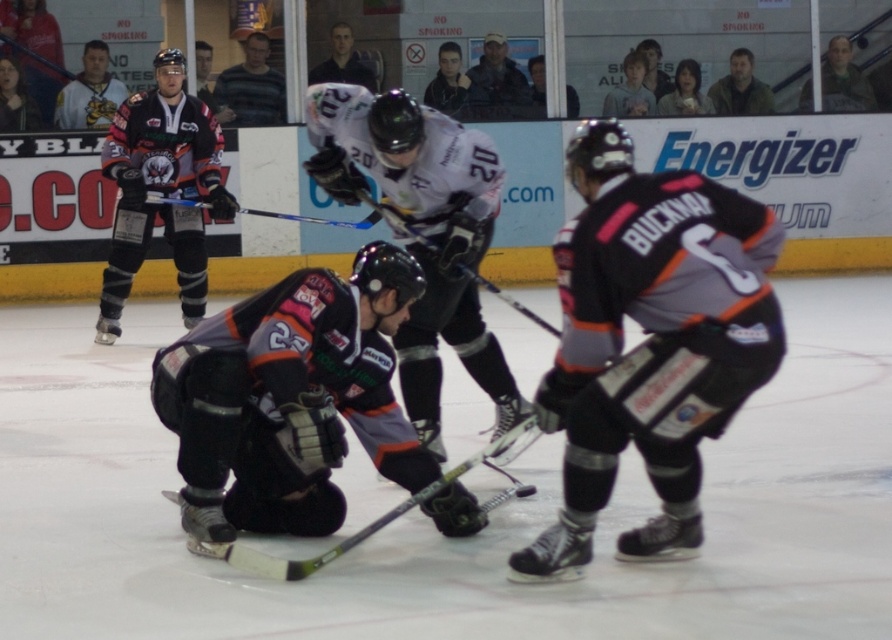
Question: Which object appears closest to the camera in this image?

Choices:
 (A) gray/black jersey at center
 (B) blue composite hockey stick at center
 (C) white jersey at center

Answer: (A)

Question: Can you confirm if gray/black jersey at center is positioned above matte black jersey at upper left?

Choices:
 (A) no
 (B) yes

Answer: (A)

Question: Is the position of gray/black jersey at center less distant than that of white jersey at center?

Choices:
 (A) yes
 (B) no

Answer: (A)

Question: Estimate the real-world distances between objects in this image. Which object is closer to the matte black jersey at upper left?

Choices:
 (A) blue composite hockey stick at center
 (B) black matte jersey at center
 (C) white jersey at center
 (D) matte black hockey stick at center

Answer: (A)

Question: Which object is positioned closest to the matte black hockey stick at center?

Choices:
 (A) gray/black jersey at center
 (B) matte black jersey at upper left

Answer: (A)

Question: Is black matte jersey at center wider than matte black hockey stick at center?

Choices:
 (A) no
 (B) yes

Answer: (B)